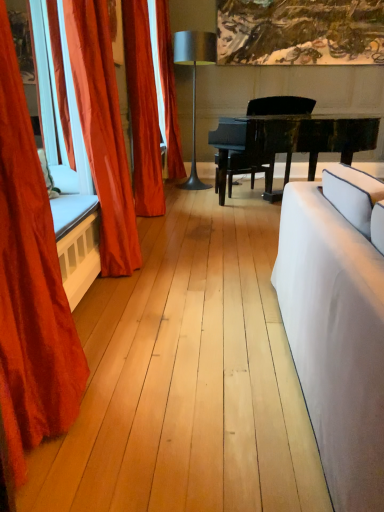
I want to click on vacant space to the right of satin orange curtain at left, marked as the third curtain in a front-to-back arrangement, so click(x=186, y=214).